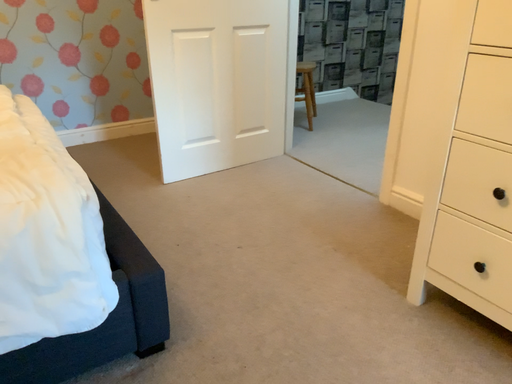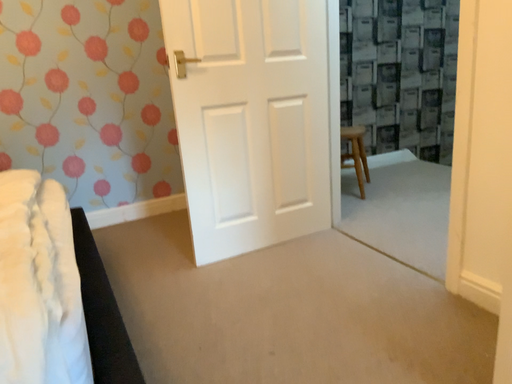
Question: Which way did the camera rotate in the video?

Choices:
 (A) rotated downward
 (B) rotated upward

Answer: (B)